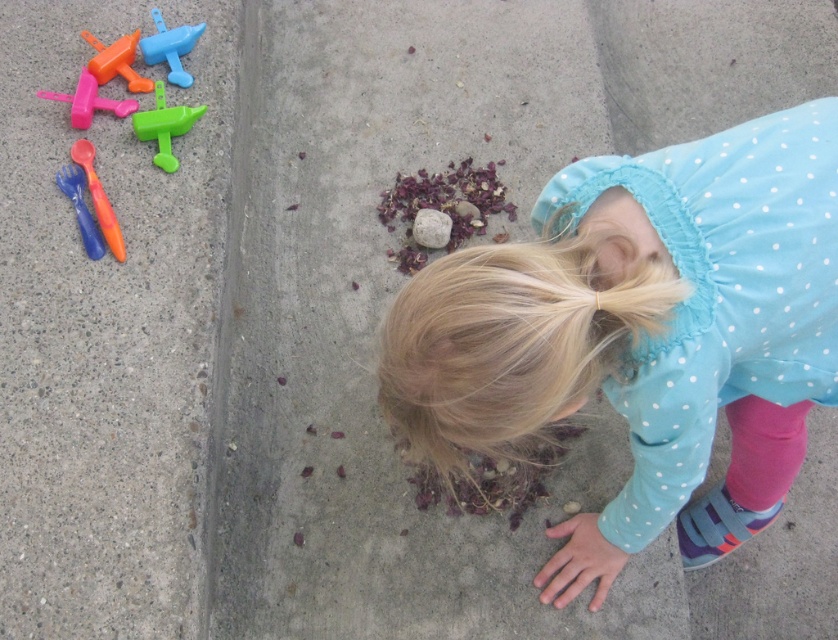
Consider the image. Does blue polka dot dress at center have a greater width compared to concrete pavement at left?

Correct, the width of blue polka dot dress at center exceeds that of concrete pavement at left.

Does blue polka dot dress at center appear on the right side of concrete pavement at left?

Correct, you'll find blue polka dot dress at center to the right of concrete pavement at left.

Is point (742, 172) positioned in front of point (78, 275)?

Yes, it is.

You are a GUI agent. You are given a task and a screenshot of the screen. Output one action in this format:
    pyautogui.click(x=<x>, y=<y>)
    Task: Click on the blue polka dot dress at center
    The width and height of the screenshot is (838, 640).
    Given the screenshot: What is the action you would take?
    pyautogui.click(x=642, y=333)

Which is above, translucent plastic toy airplane at upper left or translucent plastic spoon at upper left?

translucent plastic toy airplane at upper left is above.

This screenshot has width=838, height=640. I want to click on translucent plastic toy airplane at upper left, so click(x=89, y=100).

Where is `translucent plastic toy airplane at upper left`? This screenshot has width=838, height=640. translucent plastic toy airplane at upper left is located at coordinates (89, 100).

Can you confirm if translucent plastic airplane at upper left is taller than translucent plastic fork at upper left?

Incorrect, translucent plastic airplane at upper left's height is not larger of translucent plastic fork at upper left's.

Who is higher up, translucent plastic airplane at upper left or translucent plastic fork at upper left?

translucent plastic airplane at upper left is above.

Based on the photo, who is more forward, (x=180, y=38) or (x=68, y=173)?

Point (x=68, y=173) is more forward.

The height and width of the screenshot is (640, 838). What are the coordinates of `translucent plastic airplane at upper left` in the screenshot? It's located at (169, 48).